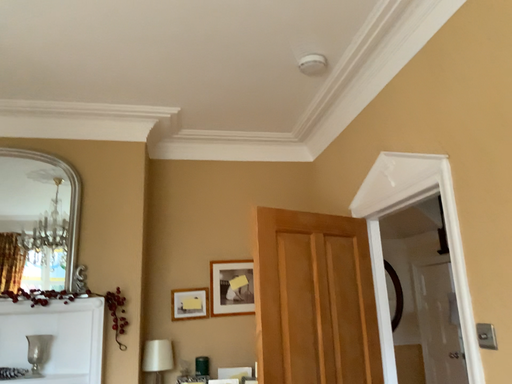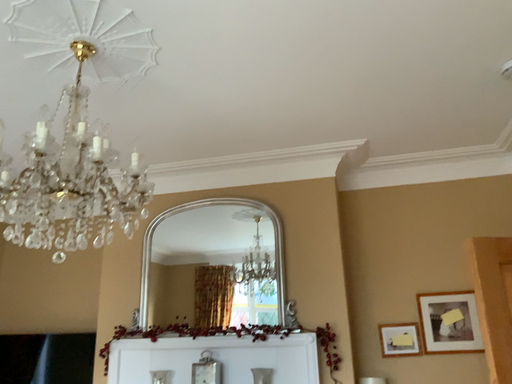
Question: How did the camera likely rotate when shooting the video?

Choices:
 (A) rotated right
 (B) rotated left

Answer: (B)